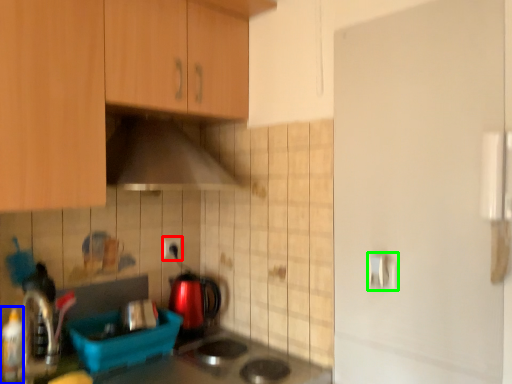
Question: Which is nearer to the electric outlet (highlighted by a red box)? bottle (highlighted by a blue box) or door handle (highlighted by a green box).

Choices:
 (A) bottle
 (B) door handle

Answer: (A)